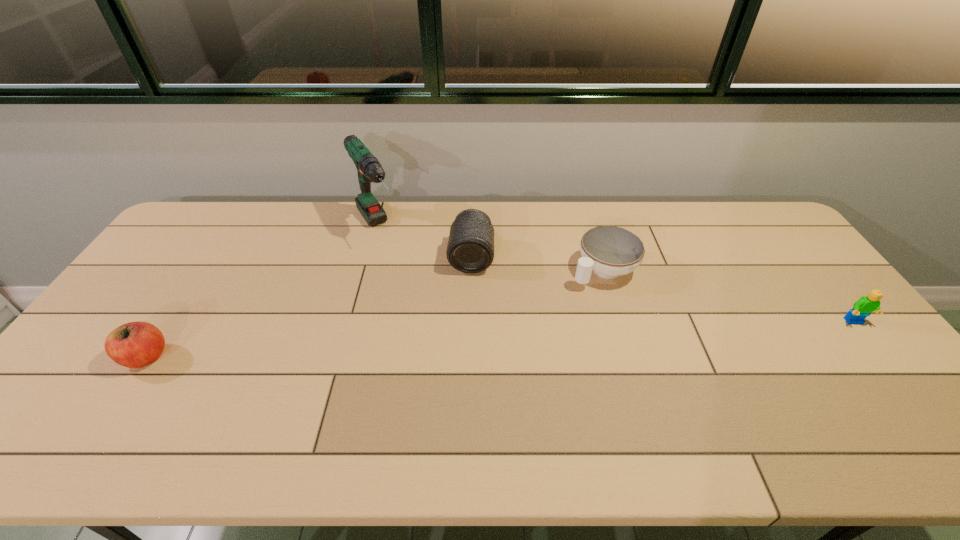
Select which object is the second closest to the tallest object. Please provide its 2D coordinates. Your answer should be formatted as a tuple, i.e. [(x, y)], where the tuple contains the x and y coordinates of a point satisfying the conditions above.

[(137, 344)]

You are a GUI agent. You are given a task and a screenshot of the screen. Output one action in this format:
    pyautogui.click(x=<x>, y=<y>)
    Task: Click on the free space that satisfies the following two spatial constraints: 1. on the back side of the leftmost object; 2. on the left side of the tallest object
    
    Given the screenshot: What is the action you would take?
    pyautogui.click(x=231, y=228)

Find the location of a particular element. vacant point that satisfies the following two spatial constraints: 1. on the front side of the second object from right to left; 2. on the left side of the drill is located at coordinates (367, 269).

At what (x,y) coordinates should I click in order to perform the action: click on free space that satisfies the following two spatial constraints: 1. on the front side of the second tallest object; 2. on the right side of the chinaware. Please return your answer as a coordinate pair (x, y). The width and height of the screenshot is (960, 540). Looking at the image, I should click on (471, 269).